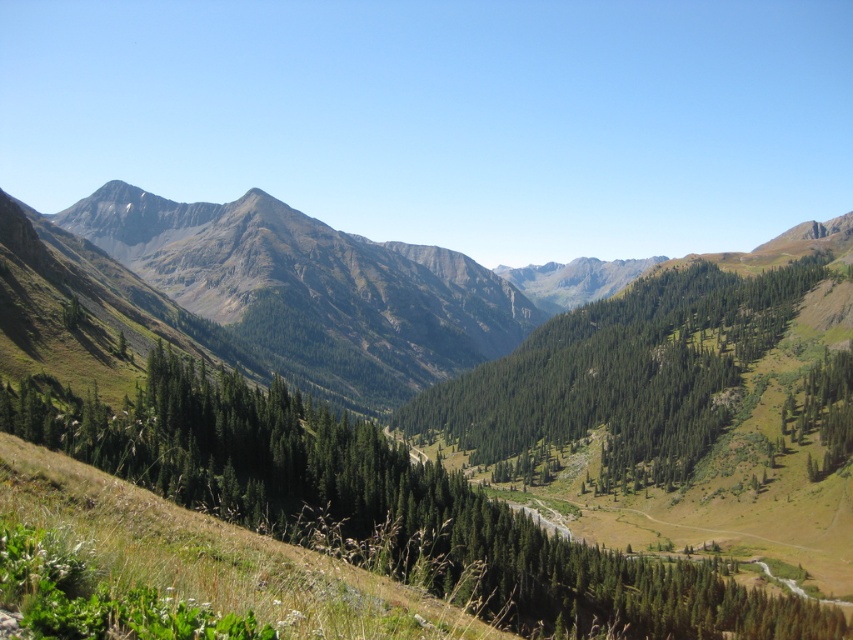
You are a hiker planning to climb the mountain. You see the point marked on the map at coordinates point (312, 458). What is the terrain like at that location?

The point (312, 458) indicates green grassy mountain at center, so the terrain there is green grassy mountain.

You are a hiker planning to traverse the area shown in the image. You need to move from the green grassy mountain at center to the green textured trees at center. Based on their positions, which direction should you head to reach the trees from the mountain?

The green grassy mountain at center is positioned over the green textured trees at center, so to reach the trees from the mountain, you should head downward.